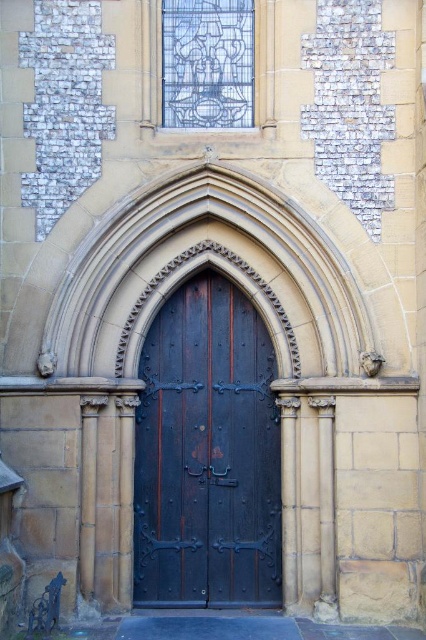
Consider the image. Who is taller, dark wood door at center or blue stained glass at upper center?

With more height is blue stained glass at upper center.

Which is behind, point (169, 364) or point (204, 80)?

The point (169, 364) is behind.

You are a GUI agent. You are given a task and a screenshot of the screen. Output one action in this format:
    pyautogui.click(x=<x>, y=<y>)
    Task: Click on the dark wood door at center
    
    Given the screenshot: What is the action you would take?
    pyautogui.click(x=207, y=454)